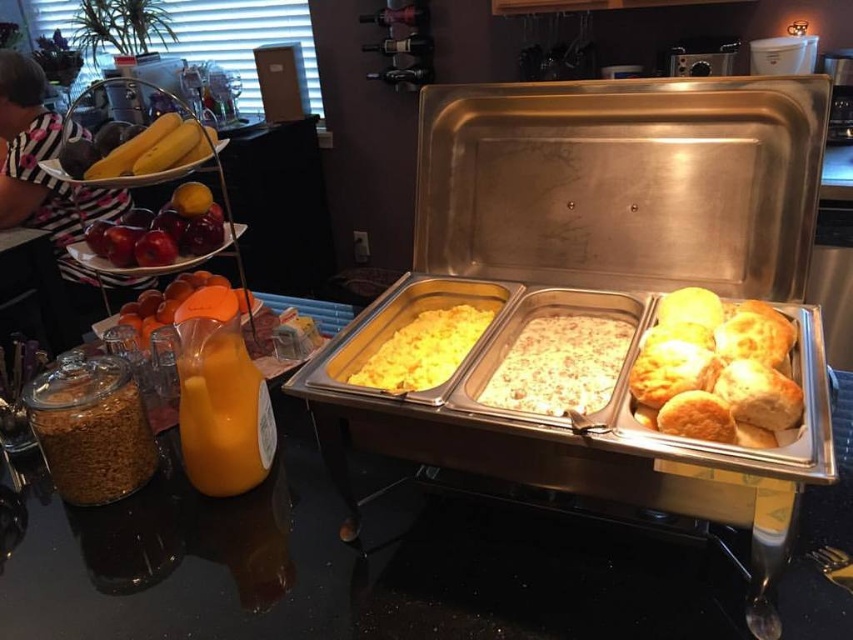
Can you confirm if white creamy casserole at center is shorter than yellow matte scrambled eggs at center?

Incorrect, white creamy casserole at center's height does not fall short of yellow matte scrambled eggs at center's.

Who is more forward, (x=558, y=380) or (x=407, y=368)?

Positioned in front is point (x=558, y=380).

Locate an element on the screen. white creamy casserole at center is located at coordinates (560, 365).

Does shiny red apples at left have a smaller size compared to translucent orange juice at left?

Correct, shiny red apples at left occupies less space than translucent orange juice at left.

Is point (160, 241) in front of point (157, 328)?

Yes, point (160, 241) is in front of point (157, 328).

Find the location of a particular element. shiny red apples at left is located at coordinates (161, 230).

Looking at this image, between translucent plastic bottle at lower left and shiny red apples at left, which one is positioned lower?

translucent plastic bottle at lower left is lower down.

Which of these two, translucent plastic bottle at lower left or shiny red apples at left, stands shorter?

Standing shorter between the two is shiny red apples at left.

Identify the location of translucent plastic bottle at lower left. (222, 410).